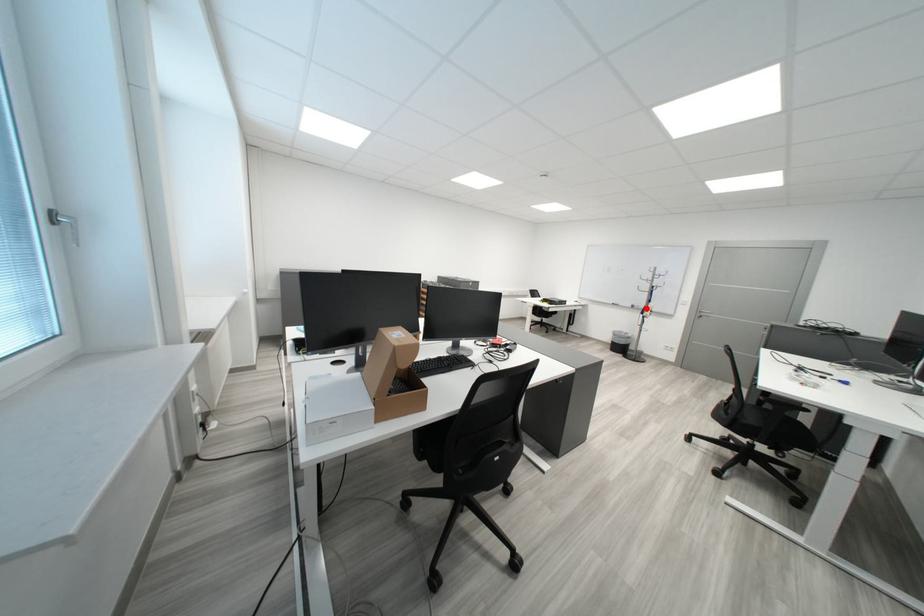
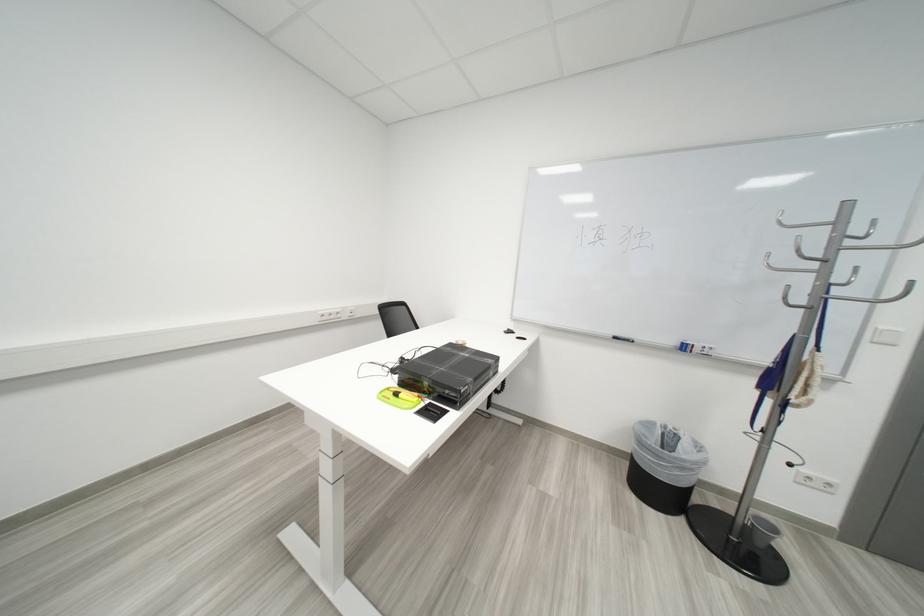
Question: I am providing you with two images of the same scene from different viewpoints. Image1 has a red point marked. In image2, the corresponding 3D location appears at what relative position? Reply with the corresponding letter.

Choices:
 (A) Closer
 (B) Farther

Answer: (B)